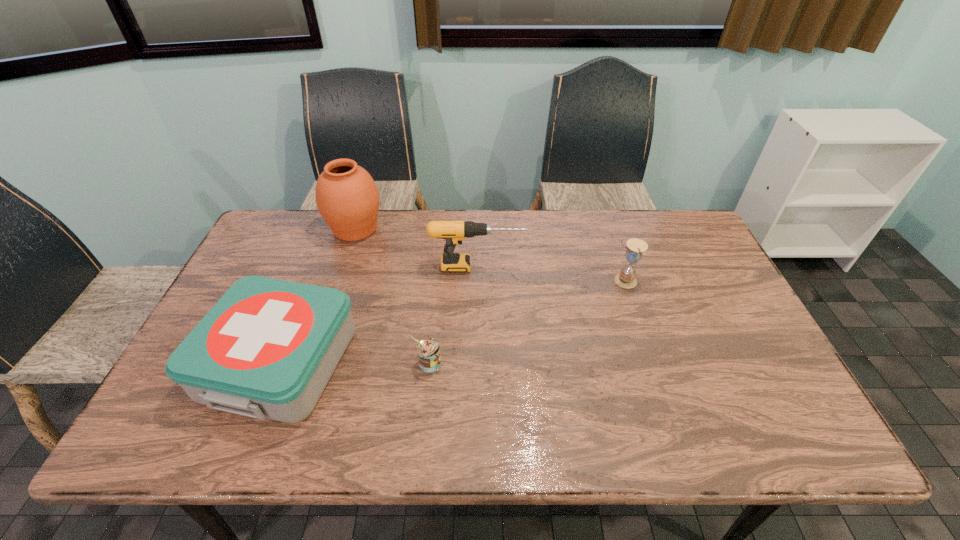
This screenshot has height=540, width=960. I want to click on vacant space at the near right corner of the desktop, so click(781, 424).

Where is `vacant area that lies between the first-aid kit and the shortest object`? The width and height of the screenshot is (960, 540). vacant area that lies between the first-aid kit and the shortest object is located at coordinates (355, 362).

The height and width of the screenshot is (540, 960). Identify the location of vacant area that lies between the first-aid kit and the hourglass. (452, 321).

This screenshot has width=960, height=540. I want to click on free space between the can and the drill, so pos(453,315).

The image size is (960, 540). I want to click on vacant space that is in between the can and the urn, so click(x=393, y=296).

Where is `vacant region between the can and the tallest object`? vacant region between the can and the tallest object is located at coordinates (393, 296).

You are a GUI agent. You are given a task and a screenshot of the screen. Output one action in this format:
    pyautogui.click(x=<x>, y=<y>)
    Task: Click on the vacant area between the second shortest object and the shortest object
    The height and width of the screenshot is (540, 960).
    Given the screenshot: What is the action you would take?
    pyautogui.click(x=355, y=362)

Where is `vacant area that lies between the first-aid kit and the can`? This screenshot has width=960, height=540. vacant area that lies between the first-aid kit and the can is located at coordinates (355, 362).

The height and width of the screenshot is (540, 960). What are the coordinates of `free space between the shortest object and the hourglass` in the screenshot? It's located at (527, 322).

Find the location of a particular element. vacant space in between the drill and the hourglass is located at coordinates (550, 274).